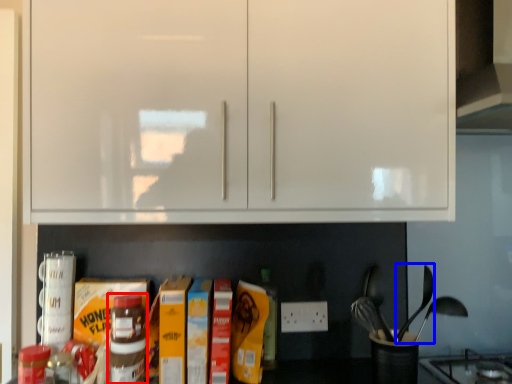
Question: Which object appears farthest to the camera in this image, bottle (highlighted by a red box) or silverware (highlighted by a blue box)?

Choices:
 (A) bottle
 (B) silverware

Answer: (B)